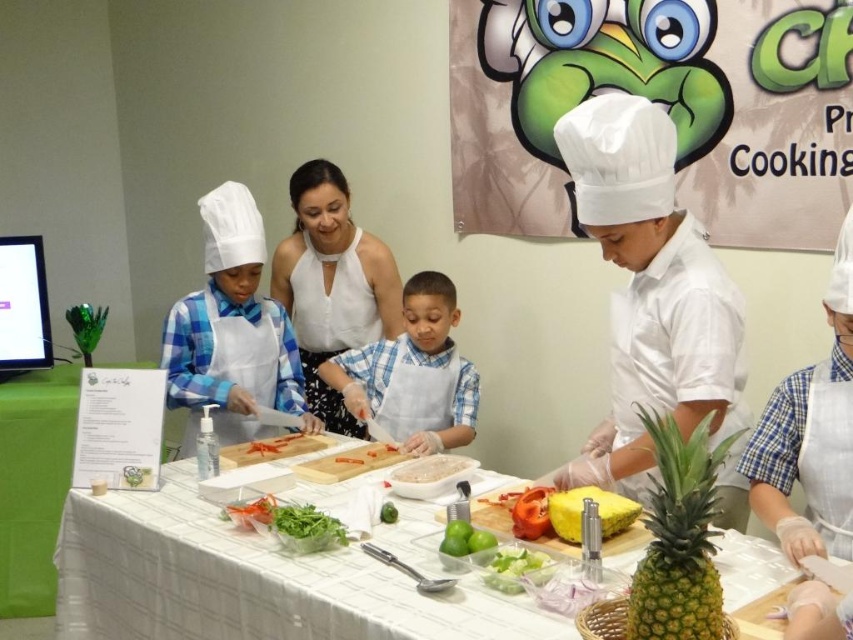
The children are preparing a dish using ingredients on the table. There is a point at coordinates (413, 372). What is this point located on?

The point at coordinates (413, 372) is located on the blue plaid shirt at center.

You are a child in the cooking class and need to place the matte white chef hat at center and the green leafy vegetable at center on a shelf. Which object should you place first to ensure they both fit on the shelf?

The matte white chef hat at center might be wider than green leafy vegetable at center, so you should place the wider matte white chef hat at center first to ensure both fit on the shelf.